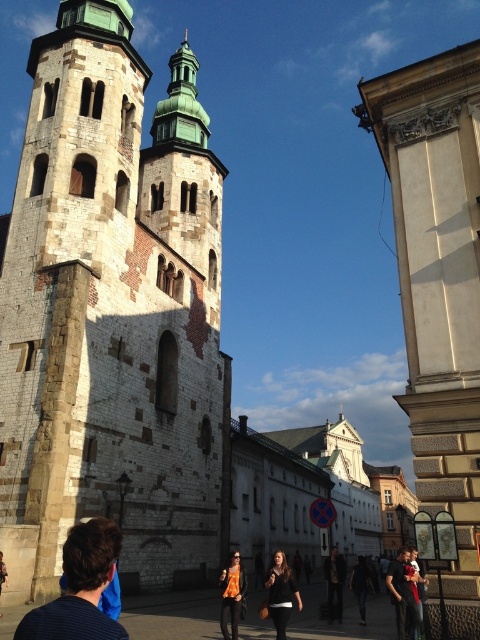
You are standing in the square and want to walk towards the church. You notice two points marked on the ground ahead of you. The first point is at coordinates point (88,561) and the second is at point (397,552). Which point is closer to you as you face the church?

Point (88,561) is closer to you than point (397,552) because it is nearer to your position facing the church.

You are standing in the square and notice two women. One is wearing an orange floral top and black pants, and the other is wearing a dark outfit. If you look towards the point marked at coordinates (80, 588), which woman is closest to that location?

The dark blue shirt at lower left is located at point (80, 588), so the woman wearing the dark outfit is closest to that location.

You are standing in the square and want to take a photo of the dark brown leather jacket at center without including the white stone tower at center in the frame. Which direction should you move relative to the jacket?

Move to the right side of the dark brown leather jacket at center so that the white stone tower at center, which is to the left of the jacket, is no longer in the frame.